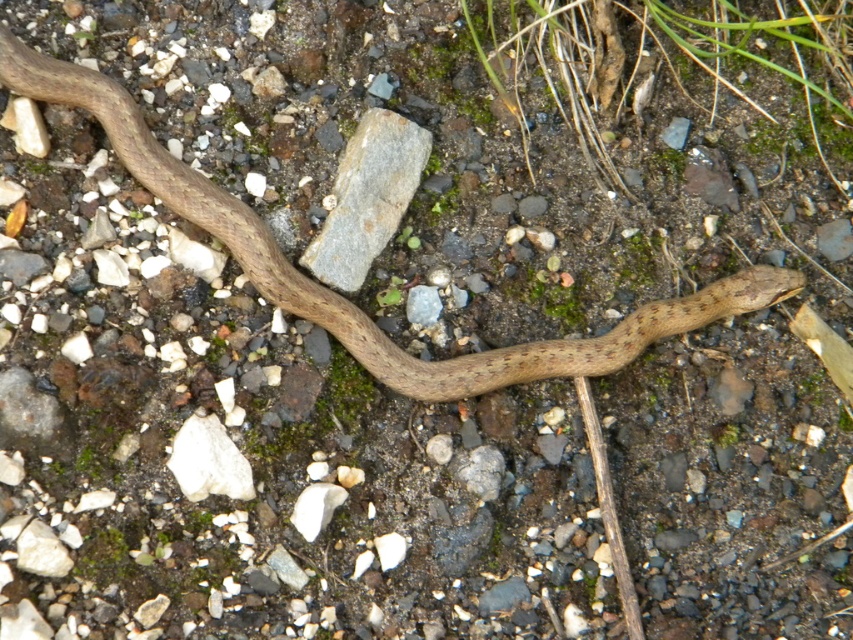
Question: Among these points, which one is farthest from the camera?

Choices:
 (A) click(711, 292)
 (B) click(384, 195)

Answer: (A)

Question: Which object is closer to the camera taking this photo?

Choices:
 (A) gray rock at center
 (B) white matte rock at lower left
 (C) brown matte snake at center

Answer: (C)

Question: Is gray rock at center further to the viewer compared to white matte rock at lower left?

Choices:
 (A) no
 (B) yes

Answer: (B)

Question: Which point is closer to the camera?

Choices:
 (A) (194, 198)
 (B) (352, 248)

Answer: (A)

Question: Is gray rock at center thinner than white matte rock at lower left?

Choices:
 (A) no
 (B) yes

Answer: (A)

Question: Is gray rock at center above white matte rock at lower left?

Choices:
 (A) no
 (B) yes

Answer: (B)